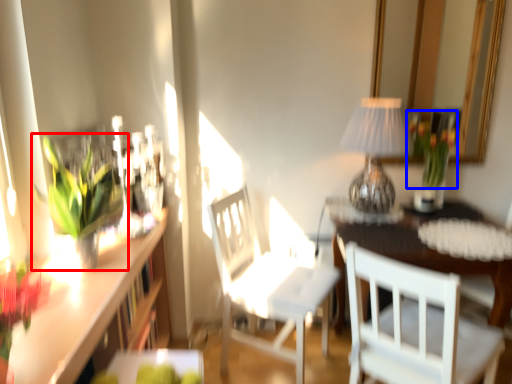
Question: Among these objects, which one is farthest to the camera, houseplant (highlighted by a red box) or floral arrangement (highlighted by a blue box)?

Choices:
 (A) houseplant
 (B) floral arrangement

Answer: (B)